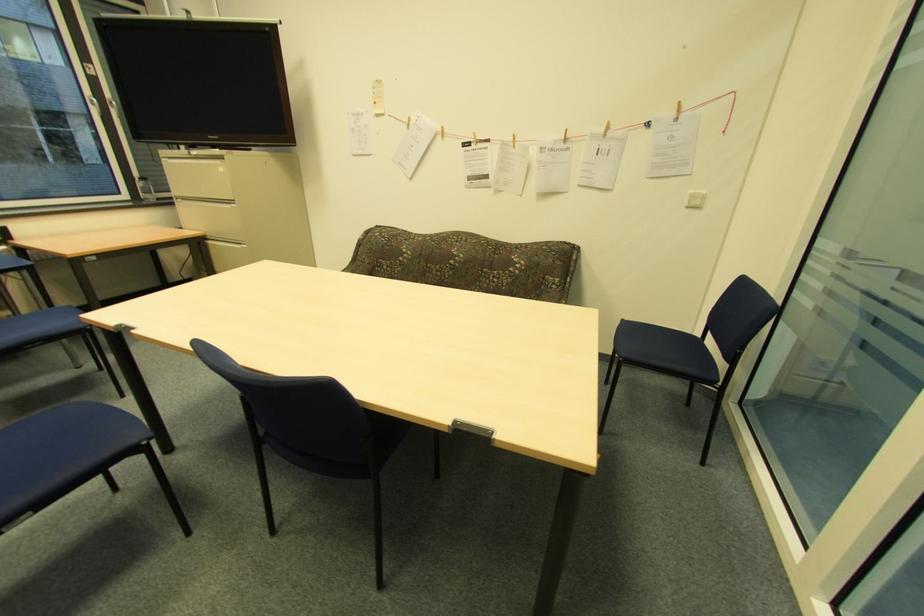
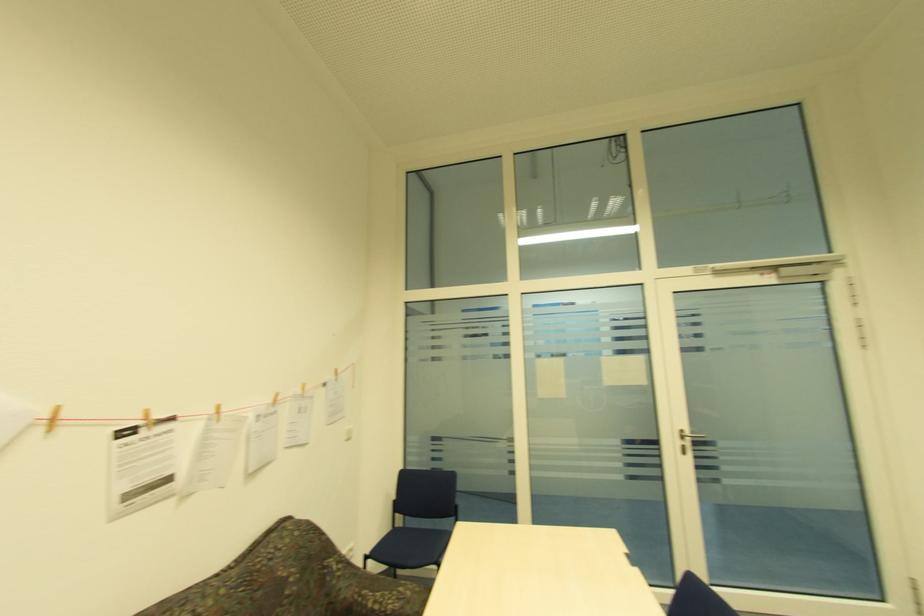
The point at (x=442, y=131) is marked in the first image. Where is the corresponding point in the second image?

(49, 416)